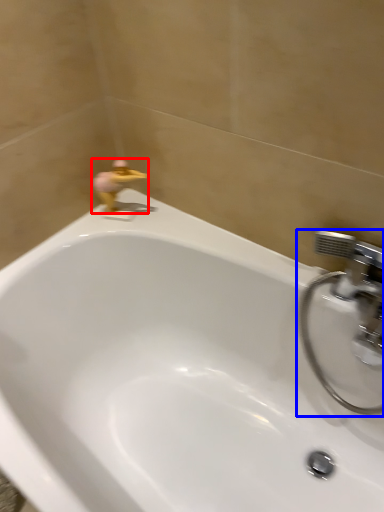
Question: Among these objects, which one is farthest to the camera, plumbing fixture (highlighted by a red box) or tap (highlighted by a blue box)?

Choices:
 (A) plumbing fixture
 (B) tap

Answer: (A)